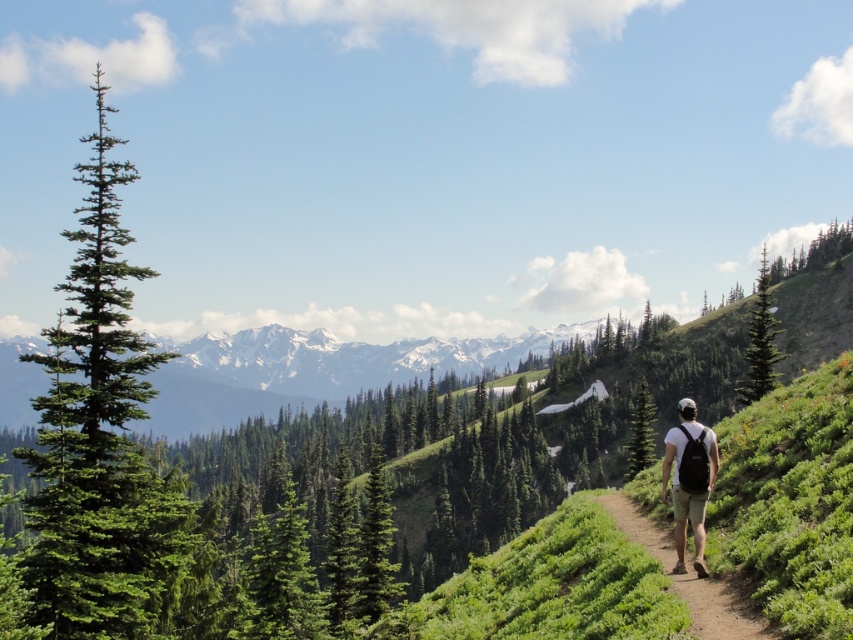
Question: In this image, where is green needle-like tree at left located relative to green needle-like tree at center?

Choices:
 (A) right
 (B) left

Answer: (B)

Question: Among these points, which one is farthest from the camera?

Choices:
 (A) (639, 458)
 (B) (704, 573)
 (C) (160, 426)

Answer: (C)

Question: Can you confirm if green needle-like tree at left is thinner than green needle-like tree at center?

Choices:
 (A) yes
 (B) no

Answer: (B)

Question: Which of these objects is positioned farthest from the green needle-like tree at center?

Choices:
 (A) green textured tree at upper right
 (B) snowy granite mountain at center
 (C) brown dirt path at center

Answer: (B)

Question: Which is farther from the green textured tree at upper right?

Choices:
 (A) snowy granite mountain at center
 (B) brown dirt path at center
 (C) green textured pine tree at center

Answer: (A)

Question: Does snowy granite mountain at center appear under green textured pine tree at center?

Choices:
 (A) no
 (B) yes

Answer: (B)